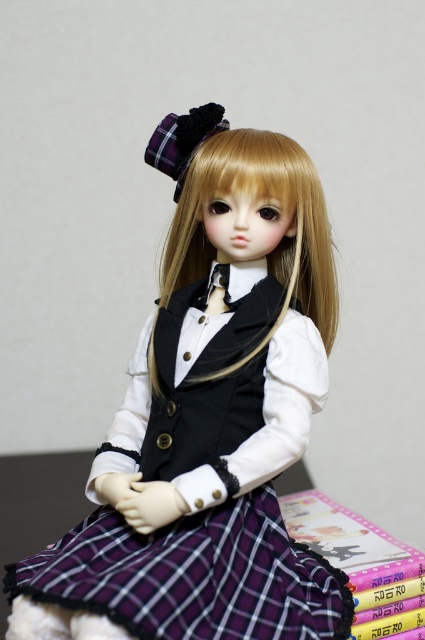
You are a photographer trying to capture the doll in the image. The plaid fabric dress at center and the plastic book at lower right are both in your view. Which object is nearer to your camera lens?

The plaid fabric dress at center is closer to the viewer than the plastic book at lower right, so the plaid fabric dress at center is nearer to the camera lens.

You are a toy organizer trying to place the plaid fabric dress at center and the plastic book at lower right on a shelf. Based on their sizes, which item will require more horizontal space on the shelf?

The plaid fabric dress at center requires more horizontal space because its width is larger than the plastic book at lower right.